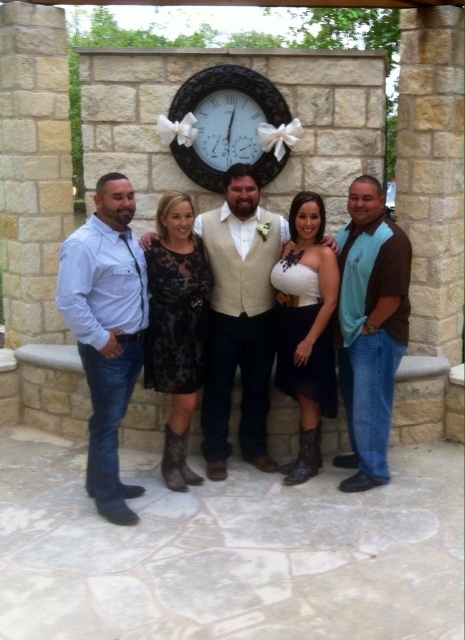
Between black lace dress at center and white satin dress at center, which one appears on the right side from the viewer's perspective?

From the viewer's perspective, white satin dress at center appears more on the right side.

Is point (193, 387) farther from viewer compared to point (287, 292)?

No, (193, 387) is in front of (287, 292).

The width and height of the screenshot is (465, 640). Identify the location of black lace dress at center. (177, 326).

Can you confirm if black painted wood clock at center is positioned to the right of black wooden clock at center?

Incorrect, black painted wood clock at center is not on the right side of black wooden clock at center.

Looking at this image, is black painted wood clock at center shorter than black wooden clock at center?

In fact, black painted wood clock at center may be taller than black wooden clock at center.

What do you see at coordinates (227, 124) in the screenshot? This screenshot has height=640, width=465. I see `black painted wood clock at center` at bounding box center [227, 124].

Where is `black painted wood clock at center`? Image resolution: width=465 pixels, height=640 pixels. black painted wood clock at center is located at coordinates (227, 124).

Who is more distant from viewer, (280, 364) or (268, 176)?

Point (268, 176)

Is point (317, 353) less distant than point (232, 77)?

That is True.

Where is `white satin dress at center`? white satin dress at center is located at coordinates (305, 328).